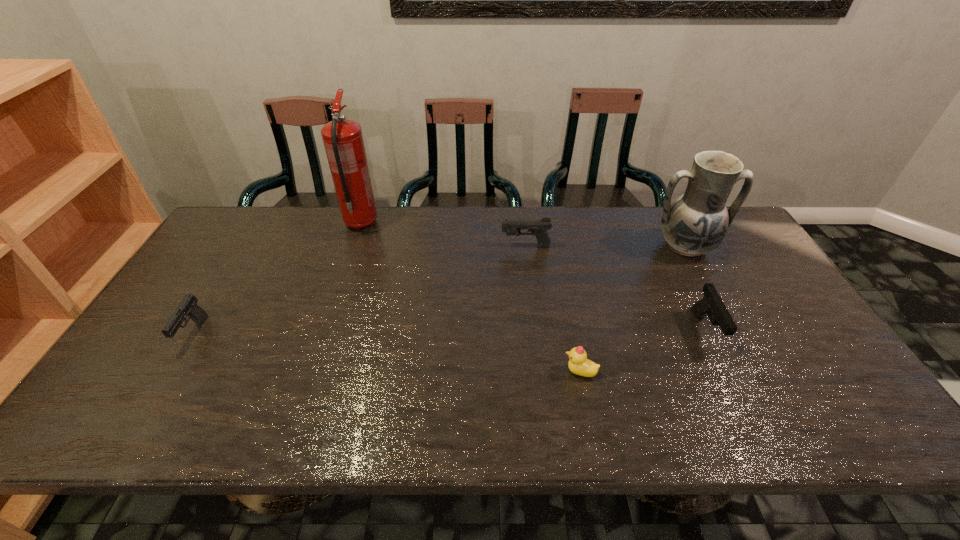
Where is `unoccupied area between the duckling and the tallest object`? The height and width of the screenshot is (540, 960). unoccupied area between the duckling and the tallest object is located at coordinates (470, 298).

I want to click on empty space between the tallest object and the duckling, so click(x=470, y=298).

Image resolution: width=960 pixels, height=540 pixels. Identify the location of free space that is in between the pitcher and the second pistol from right to left. (606, 247).

Identify the location of blank region between the rightmost pistol and the pitcher. The height and width of the screenshot is (540, 960). (695, 289).

Find the location of `vacant area that lies between the second pistol from right to left and the rightmost pistol`. vacant area that lies between the second pistol from right to left and the rightmost pistol is located at coordinates (615, 288).

The height and width of the screenshot is (540, 960). I want to click on free space between the nearest object and the pitcher, so click(633, 309).

Locate an element on the screen. This screenshot has height=540, width=960. free space between the nearest object and the leftmost pistol is located at coordinates (387, 353).

The image size is (960, 540). I want to click on empty space that is in between the second pistol from left to right and the fire extinguisher, so click(x=444, y=235).

You are a GUI agent. You are given a task and a screenshot of the screen. Output one action in this format:
    pyautogui.click(x=<x>, y=<y>)
    Task: Click on the free spot between the fire extinguisher and the nearest object
    This screenshot has width=960, height=540.
    Given the screenshot: What is the action you would take?
    pyautogui.click(x=470, y=298)

I want to click on object that can be found as the closest to the duckling, so point(711,305).